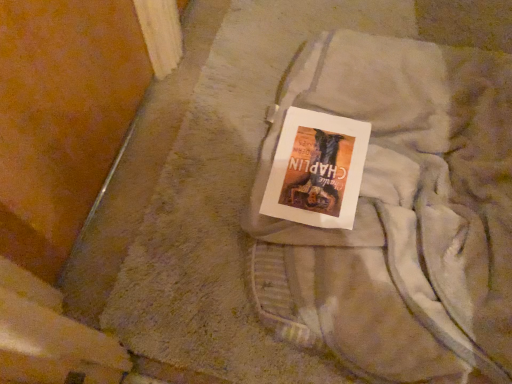
Question: From the image's perspective, is light gray cotton laundry at center under matte paper book at center?

Choices:
 (A) no
 (B) yes

Answer: (B)

Question: Is light gray cotton laundry at center bigger than matte paper book at center?

Choices:
 (A) yes
 (B) no

Answer: (A)

Question: Is light gray cotton laundry at center taller than matte paper book at center?

Choices:
 (A) yes
 (B) no

Answer: (A)

Question: Does light gray cotton laundry at center have a greater width compared to matte paper book at center?

Choices:
 (A) yes
 (B) no

Answer: (A)

Question: Considering the relative positions of light gray cotton laundry at center and matte paper book at center in the image provided, is light gray cotton laundry at center to the right of matte paper book at center from the viewer's perspective?

Choices:
 (A) yes
 (B) no

Answer: (A)

Question: Is light gray cotton laundry at center next to matte paper book at center and touching it?

Choices:
 (A) yes
 (B) no

Answer: (B)

Question: Can you see matte paper book at center touching light gray cotton laundry at center?

Choices:
 (A) yes
 (B) no

Answer: (B)

Question: Is light gray cotton laundry at center at the back of matte paper book at center?

Choices:
 (A) no
 (B) yes

Answer: (B)

Question: From a real-world perspective, does matte paper book at center sit lower than light gray cotton laundry at center?

Choices:
 (A) yes
 (B) no

Answer: (B)

Question: Would you say matte paper book at center is a long distance from light gray cotton laundry at center?

Choices:
 (A) no
 (B) yes

Answer: (A)

Question: From the image's perspective, is matte paper book at center beneath light gray cotton laundry at center?

Choices:
 (A) no
 (B) yes

Answer: (A)

Question: Is matte paper book at center further to the viewer compared to light gray cotton laundry at center?

Choices:
 (A) no
 (B) yes

Answer: (B)

Question: Is light gray cotton laundry at center in front of or behind matte paper book at center in the image?

Choices:
 (A) behind
 (B) front

Answer: (B)